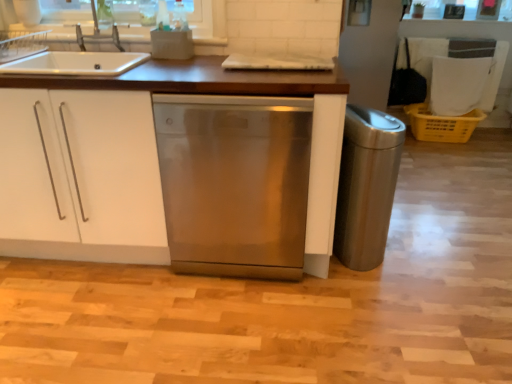
Image resolution: width=512 pixels, height=384 pixels. What do you see at coordinates (441, 124) in the screenshot?
I see `yellow plastic crate at right` at bounding box center [441, 124].

This screenshot has width=512, height=384. Describe the element at coordinates (77, 60) in the screenshot. I see `satin silver sink at upper left` at that location.

What are the coordinates of `stainless steel trash can at right` in the screenshot? It's located at (366, 186).

I want to click on yellow plastic crate at right, so click(x=441, y=124).

Considering the sizes of objects stainless steel dishwasher at center and yellow plastic crate at right in the image provided, who is shorter, stainless steel dishwasher at center or yellow plastic crate at right?

Standing shorter between the two is yellow plastic crate at right.

What's the angular difference between stainless steel dishwasher at center and yellow plastic crate at right's facing directions?

There is a 1.53-degree angle between the facing directions of stainless steel dishwasher at center and yellow plastic crate at right.

Is point (210, 228) farther from camera compared to point (445, 116)?

No, (210, 228) is in front of (445, 116).

Considering the sizes of objects stainless steel dishwasher at center and white matte cabinet at center in the image provided, who is thinner, stainless steel dishwasher at center or white matte cabinet at center?

Thinner between the two is stainless steel dishwasher at center.

From a real-world perspective, is stainless steel dishwasher at center positioned above or below white matte cabinet at center?

stainless steel dishwasher at center is below white matte cabinet at center.

Does stainless steel dishwasher at center turn towards white matte cabinet at center?

No, stainless steel dishwasher at center is not aimed at white matte cabinet at center.

Which is farther, (27, 67) or (390, 212)?

Point (390, 212)

Is satin silver sink at upper left spatially inside stainless steel trash can at right, or outside of it?

satin silver sink at upper left is not inside stainless steel trash can at right, it's outside.

Consider the image. Considering the sizes of objects satin silver sink at upper left and stainless steel trash can at right in the image provided, who is bigger, satin silver sink at upper left or stainless steel trash can at right?

stainless steel trash can at right.

From the image's perspective, would you say satin silver sink at upper left is positioned over stainless steel trash can at right?

Correct, satin silver sink at upper left appears higher than stainless steel trash can at right in the image.

Measure the distance between satin silver sink at upper left and stainless steel dishwasher at center.

The distance of satin silver sink at upper left from stainless steel dishwasher at center is 26.44 inches.

In terms of height, does satin silver sink at upper left look taller or shorter compared to stainless steel dishwasher at center?

satin silver sink at upper left is shorter than stainless steel dishwasher at center.

From the image's perspective, who appears lower, satin silver sink at upper left or stainless steel dishwasher at center?

stainless steel dishwasher at center, from the image's perspective.

Consider the image. Can you confirm if satin silver sink at upper left is positioned to the right of stainless steel dishwasher at center?

No.

From a real-world perspective, is white matte cabinet at center on satin silver sink at upper left?

No, from a real-world perspective, white matte cabinet at center is not above satin silver sink at upper left.

From the image's perspective, is white matte cabinet at center located above or below satin silver sink at upper left?

Based on their image positions, white matte cabinet at center is located beneath satin silver sink at upper left.

How much distance is there between white matte cabinet at center and satin silver sink at upper left?

white matte cabinet at center and satin silver sink at upper left are 16.91 inches apart.

Can you confirm if white matte cabinet at center is taller than satin silver sink at upper left?

Yes, white matte cabinet at center is taller than satin silver sink at upper left.

Looking at this image, is stainless steel dishwasher at center shorter than satin silver sink at upper left?

No.

Relative to satin silver sink at upper left, is stainless steel dishwasher at center in front or behind?

In the image, stainless steel dishwasher at center appears in front of satin silver sink at upper left.

From a real-world perspective, between stainless steel dishwasher at center and satin silver sink at upper left, who is vertically lower?

From a 3D spatial view, stainless steel dishwasher at center is below.

Considering the sizes of objects stainless steel dishwasher at center and satin silver sink at upper left in the image provided, who is smaller, stainless steel dishwasher at center or satin silver sink at upper left?

satin silver sink at upper left.

Does stainless steel trash can at right have a greater width compared to satin silver sink at upper left?

Correct, the width of stainless steel trash can at right exceeds that of satin silver sink at upper left.

Measure the distance between stainless steel trash can at right and satin silver sink at upper left.

The distance of stainless steel trash can at right from satin silver sink at upper left is 1.23 meters.

Considering the relative sizes of stainless steel trash can at right and satin silver sink at upper left in the image provided, is stainless steel trash can at right smaller than satin silver sink at upper left?

No, stainless steel trash can at right is not smaller than satin silver sink at upper left.

Could you tell me if stainless steel trash can at right is facing satin silver sink at upper left?

No.

Where is `home appliance that appears in front of the yellow plastic crate at right`? Image resolution: width=512 pixels, height=384 pixels. home appliance that appears in front of the yellow plastic crate at right is located at coordinates coord(234,183).

Identify the location of cabinetry above the stainless steel dishwasher at center (from the image's perspective). (81, 177).

Estimate the real-world distances between objects in this image. Which object is further from stainless steel dishwasher at center, satin silver sink at upper left or yellow plastic crate at right?

Based on the image, yellow plastic crate at right appears to be further to stainless steel dishwasher at center.

Considering their positions, is yellow plastic crate at right positioned closer to white matte cabinet at center than stainless steel trash can at right?

The object closer to white matte cabinet at center is stainless steel trash can at right.

In the scene shown: Looking at the image, which one is located closer to satin silver sink at upper left, white matte cabinet at center or yellow plastic crate at right?

white matte cabinet at center lies closer to satin silver sink at upper left than the other object.

When comparing their distances from yellow plastic crate at right, does stainless steel trash can at right or white matte cabinet at center seem further?

white matte cabinet at center.

Estimate the real-world distances between objects in this image. Which object is closer to white matte cabinet at center, stainless steel trash can at right or satin silver sink at upper left?

satin silver sink at upper left.

Considering their positions, is white matte cabinet at center positioned further to satin silver sink at upper left than stainless steel dishwasher at center?

stainless steel dishwasher at center is further to satin silver sink at upper left.

When comparing their distances from stainless steel trash can at right, does yellow plastic crate at right or white matte cabinet at center seem closer?

Among the two, white matte cabinet at center is located nearer to stainless steel trash can at right.

When comparing their distances from stainless steel trash can at right, does satin silver sink at upper left or yellow plastic crate at right seem further?

yellow plastic crate at right lies further to stainless steel trash can at right than the other object.

Where is `kitchen appliance located between white matte cabinet at center and stainless steel dishwasher at center in the left-right direction`? The height and width of the screenshot is (384, 512). kitchen appliance located between white matte cabinet at center and stainless steel dishwasher at center in the left-right direction is located at coordinates (77, 60).

Image resolution: width=512 pixels, height=384 pixels. In order to click on appliance between stainless steel dishwasher at center and yellow plastic crate at right along the z-axis in this screenshot , I will do `click(366, 186)`.

Find the location of a particular element. The height and width of the screenshot is (384, 512). appliance located between white matte cabinet at center and yellow plastic crate at right in the left-right direction is located at coordinates (366, 186).

At what (x,y) coordinates should I click in order to perform the action: click on home appliance situated between satin silver sink at upper left and yellow plastic crate at right from left to right. Please return your answer as a coordinate pair (x, y). Looking at the image, I should click on (234, 183).